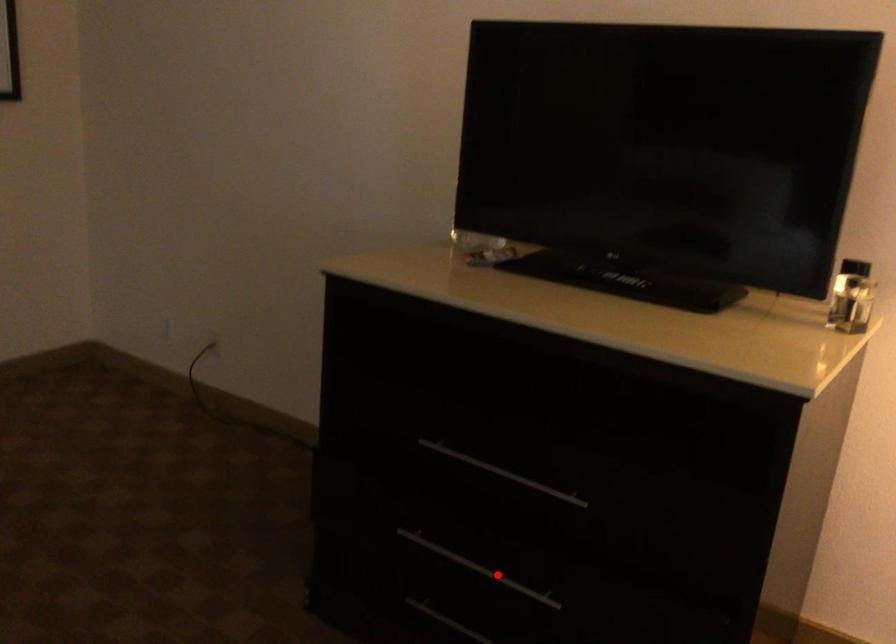
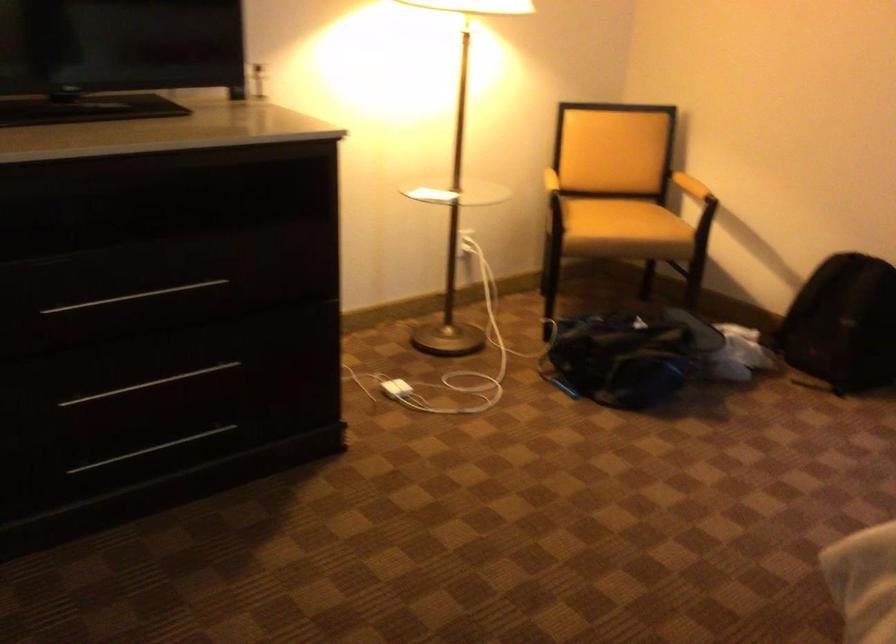
Question: I am providing you with two images of the same scene from different viewpoints. A red point is shown in image1. For the corresponding object point in image2, is it positioned nearer or farther from the camera?

Choices:
 (A) Nearer
 (B) Farther

Answer: (B)